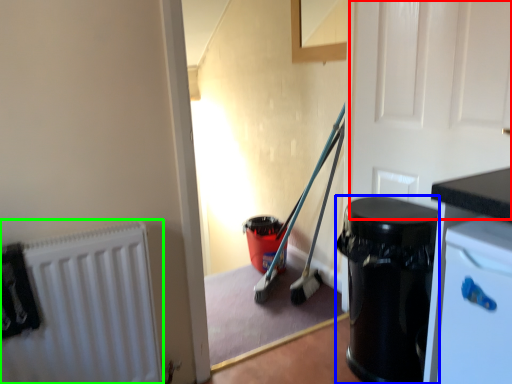
Question: Which object is the closest to the door (highlighted by a red box)? Choose among these: garbage (highlighted by a blue box) or radiator (highlighted by a green box).

Choices:
 (A) garbage
 (B) radiator

Answer: (A)